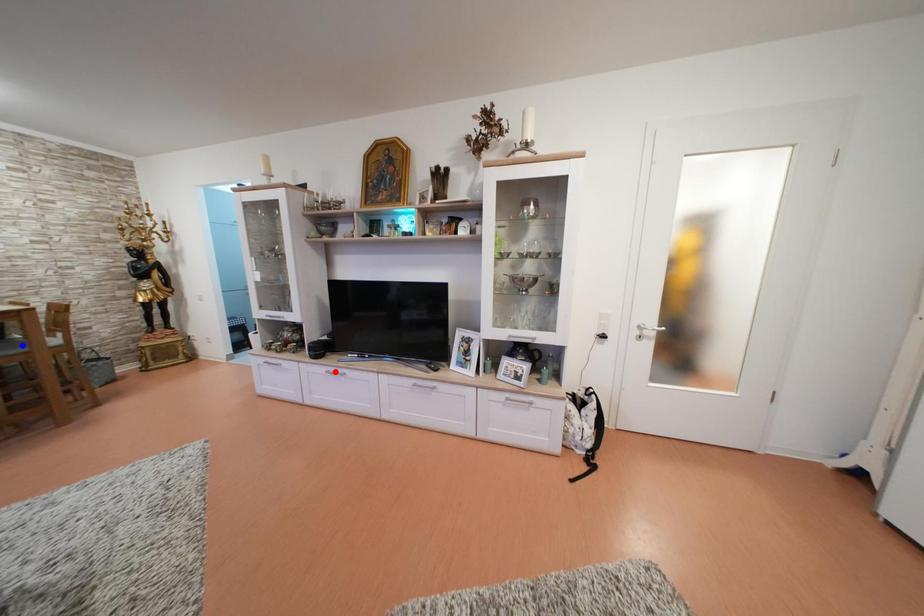
Question: Two points are marked on the image. Which point is closer to the camera?

Choices:
 (A) Blue point is closer.
 (B) Red point is closer.

Answer: (A)